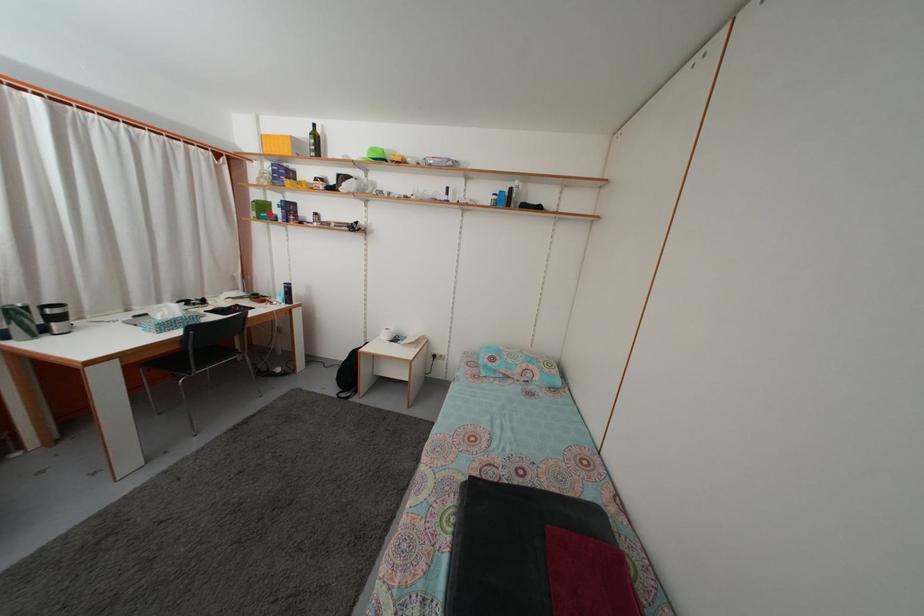
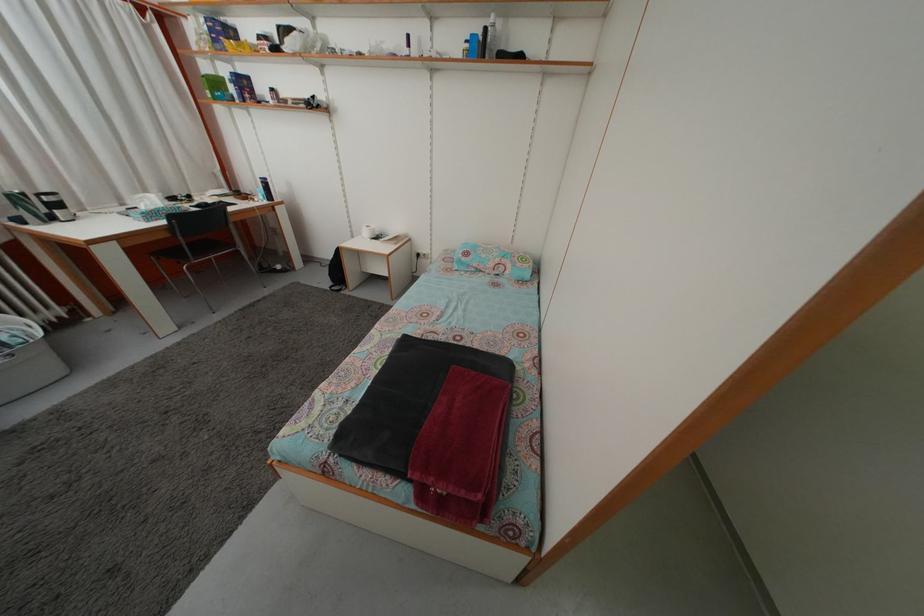
Question: I am providing you with two images of the same scene from different viewpoints. A red point is shown in image1. For the corresponding object point in image2, is it positioned nearer or farther from the camera?

Choices:
 (A) Nearer
 (B) Farther

Answer: (B)